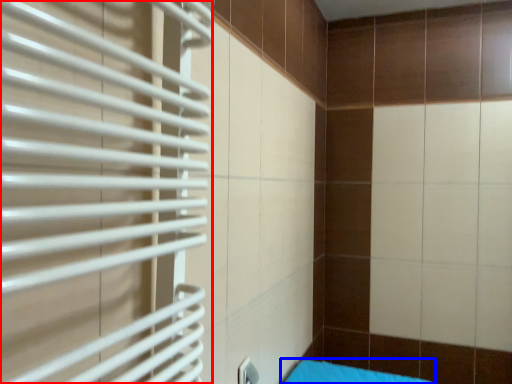
Question: Which of the following is the farthest to the observer, shutter (highlighted by a red box) or furniture (highlighted by a blue box)?

Choices:
 (A) shutter
 (B) furniture

Answer: (B)